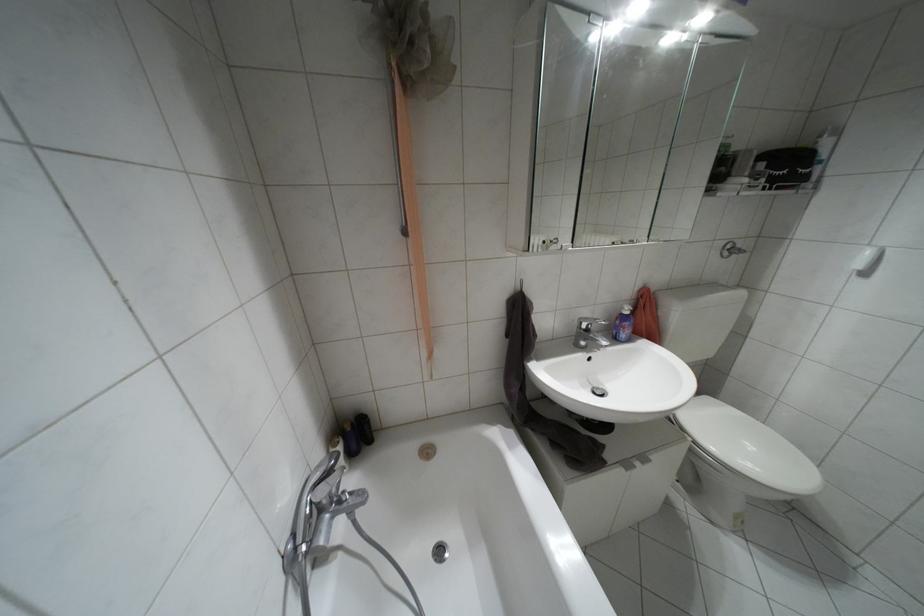
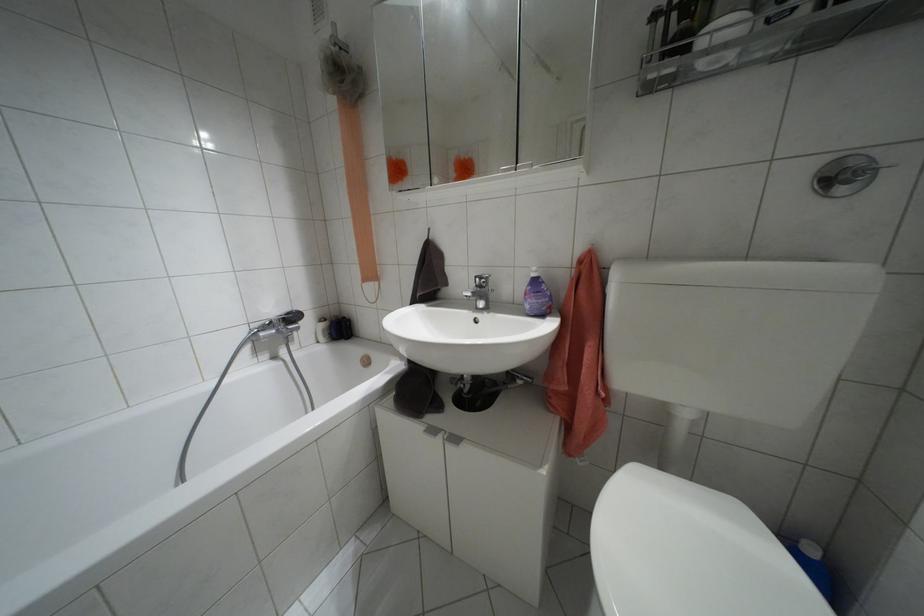
The point at (723,254) is marked in the first image. Where is the corresponding point in the second image?

(841, 190)